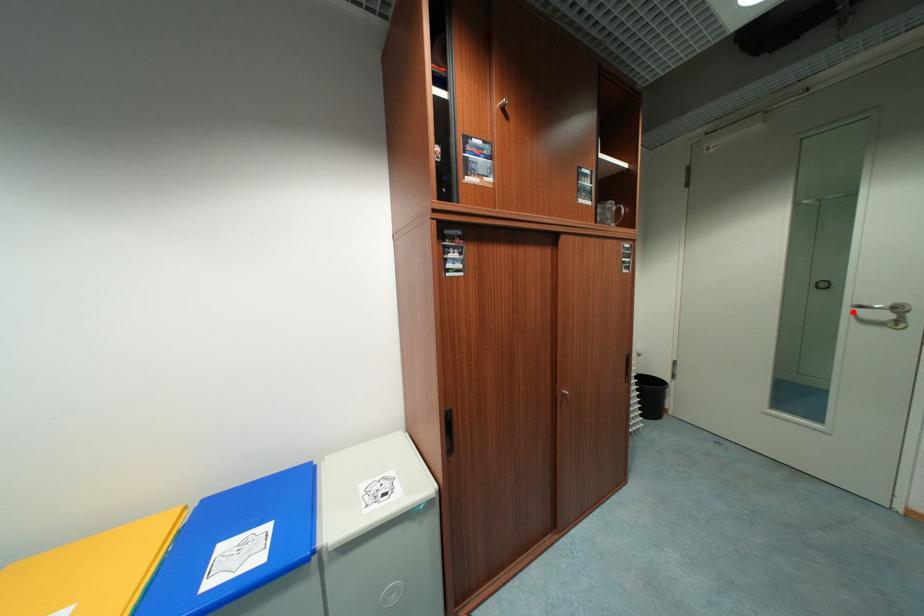
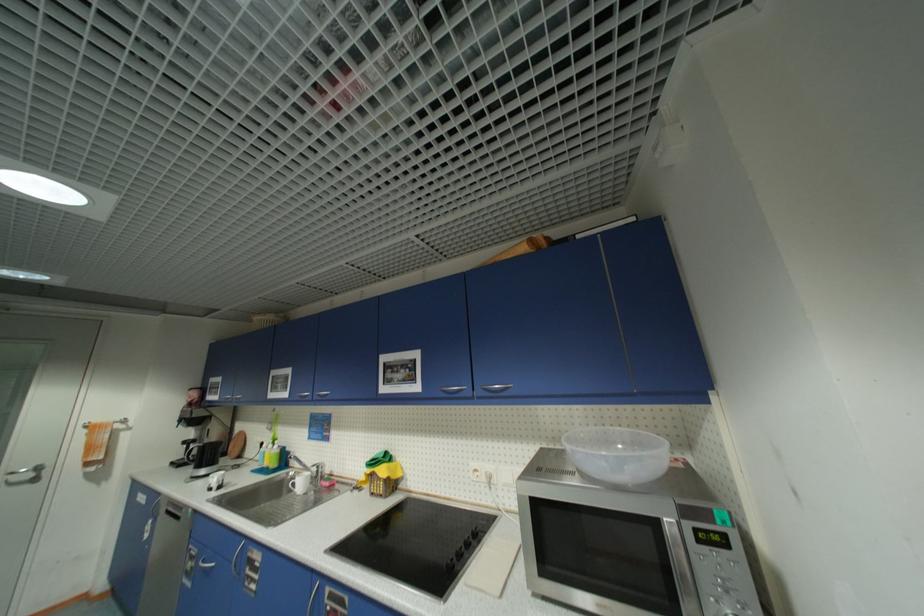
Find the pixel in the second image that matches the highlighted location in the first image.

(7, 479)